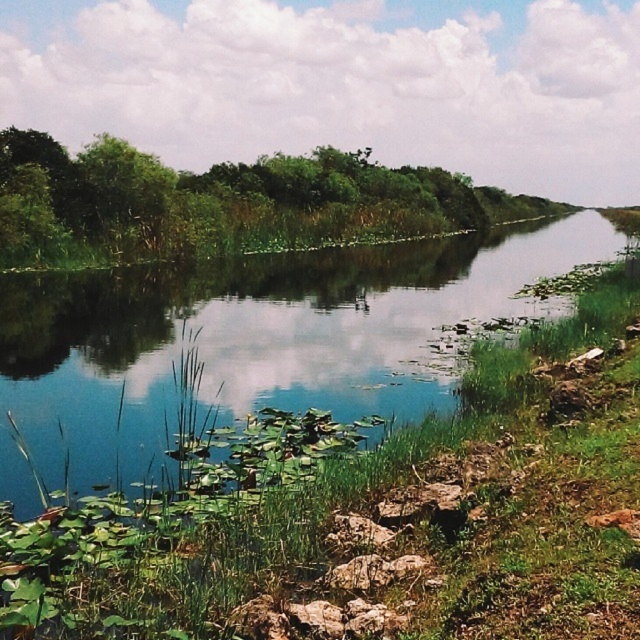
You are standing on the bank of the green grassy river at center and want to reach the green leafy trees at left. Which direction should you walk to get there?

Since the green grassy river at center is to the left of green leafy trees at left, you should walk to the right to reach the green leafy trees at left.

You are standing at the edge of the green grassy river at center and want to walk to the green leafy tree at upper left. Which direction should you go?

You should walk to the left because the green grassy river at center is to the right of the green leafy tree at upper left, so moving left will take you towards the tree.

You are standing at the edge of the green grassy river at center and want to see the tops of the green leafy trees at left. Can you see them clearly from your current position?

The green grassy river at center is shorter than the green leafy trees at left, so yes, you can see the tops of the green leafy trees at left clearly from your current position.